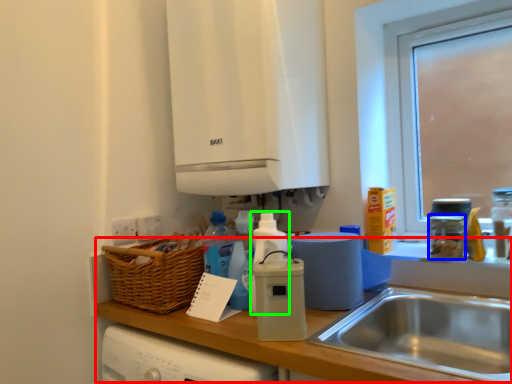
Question: Which is nearer to the counter top (highlighted by a red box)? appliance (highlighted by a blue box) or bottle (highlighted by a green box).

Choices:
 (A) appliance
 (B) bottle

Answer: (B)